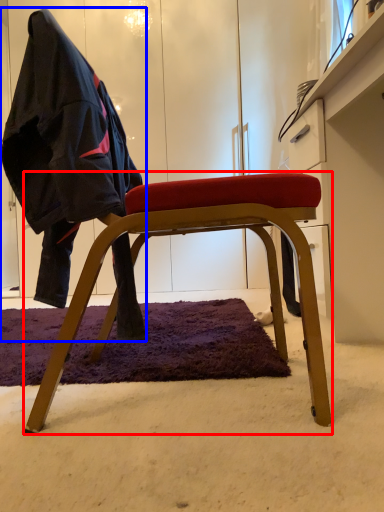
Question: Which object is closer to the camera taking this photo, chair (highlighted by a red box) or person (highlighted by a blue box)?

Choices:
 (A) chair
 (B) person

Answer: (B)